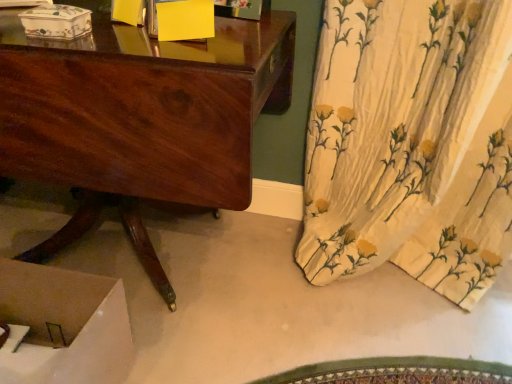
Question: Considering the relative positions of porcelain floral box at upper left, which appears as the third box when viewed from the right, and yellow paper at upper center, which appears as the second box when viewed from the right, in the image provided, is porcelain floral box at upper left, which appears as the third box when viewed from the right, to the left or to the right of yellow paper at upper center, which appears as the second box when viewed from the right,?

Choices:
 (A) right
 (B) left

Answer: (B)

Question: Is point 54,11 closer or farther from the camera than point 141,1?

Choices:
 (A) farther
 (B) closer

Answer: (B)

Question: Which of these objects is positioned closest to the yellow paper at upper center, the second box from the left?

Choices:
 (A) yellow paper at upper center, which is counted as the first box, starting from the right
 (B) shiny brown wood desk at center
 (C) porcelain floral box at upper left, which appears as the third box when viewed from the right

Answer: (A)

Question: Which object is the closest to the porcelain floral box at upper left, the first box positioned from the left?

Choices:
 (A) yellow paper at upper center, placed as the 3th box when sorted from left to right
 (B) shiny brown wood desk at center
 (C) yellow paper at upper center, the second box from the left

Answer: (C)